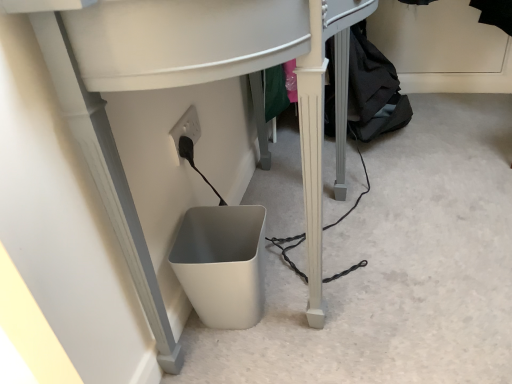
Question: Is white plastic computer desk at lower center inside or outside of white matte waste container at lower center?

Choices:
 (A) outside
 (B) inside

Answer: (A)

Question: From a real-world perspective, relative to white matte waste container at lower center, is white plastic computer desk at lower center vertically above or below?

Choices:
 (A) above
 (B) below

Answer: (A)

Question: Estimate the real-world distances between objects in this image. Which object is farther from the black fabric at lower right?

Choices:
 (A) white plastic computer desk at lower center
 (B) white matte waste container at lower center

Answer: (A)

Question: Based on their relative distances, which object is nearer to the black fabric at lower right?

Choices:
 (A) white matte waste container at lower center
 (B) white plastic computer desk at lower center

Answer: (A)